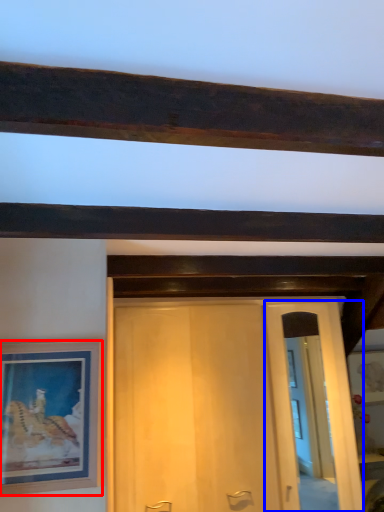
Question: Which object is closer to the camera taking this photo, picture frame (highlighted by a red box) or glass door (highlighted by a blue box)?

Choices:
 (A) picture frame
 (B) glass door

Answer: (A)